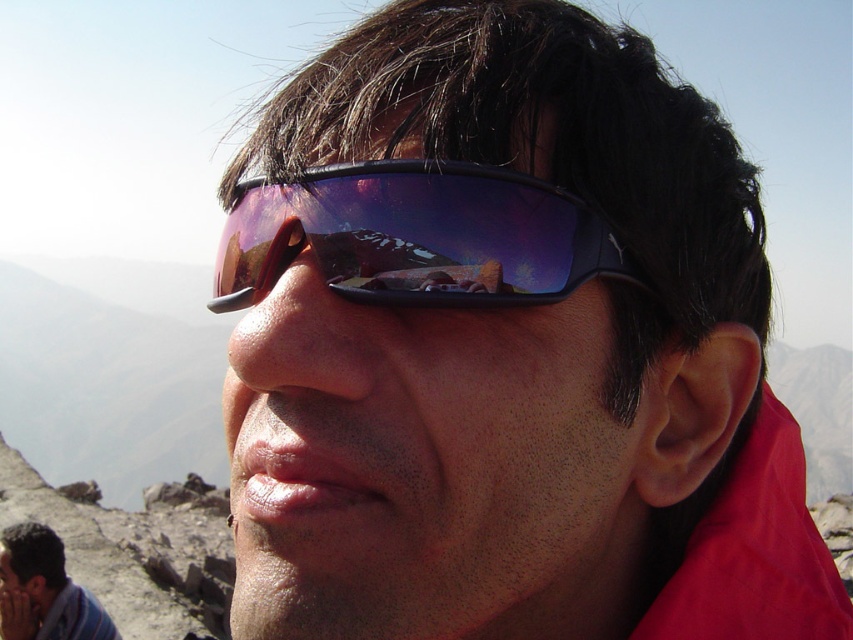
Question: Which object is farther from the camera taking this photo?

Choices:
 (A) matte blue sunglasses at lower left
 (B) purple reflective lens at center

Answer: (A)

Question: Can you confirm if purple reflective lens at center is wider than matte blue sunglasses at lower left?

Choices:
 (A) no
 (B) yes

Answer: (A)

Question: Which point is closer to the camera?

Choices:
 (A) purple reflective lens at center
 (B) matte blue sunglasses at lower left

Answer: (A)

Question: Is purple reflective lens at center wider than matte blue sunglasses at lower left?

Choices:
 (A) yes
 (B) no

Answer: (B)

Question: Which point is farther from the camera taking this photo?

Choices:
 (A) tap(9, 588)
 (B) tap(372, 273)

Answer: (A)

Question: Is purple reflective lens at center to the right of matte blue sunglasses at lower left from the viewer's perspective?

Choices:
 (A) no
 (B) yes

Answer: (B)